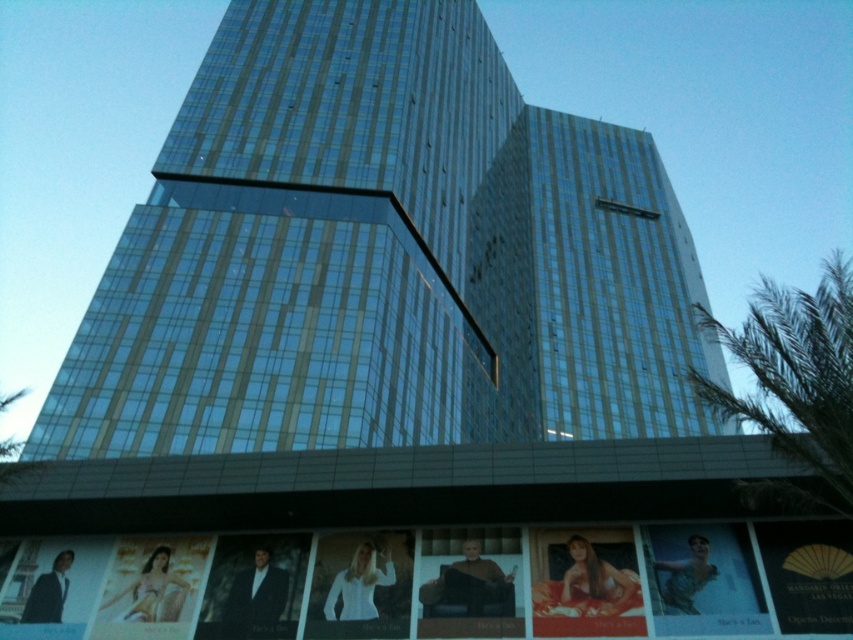
You are a fashion designer observing the scene. You notice the matte blue dress at lower right and the matte black poster at lower left. Which object is positioned higher in the image?

The matte blue dress at lower right is above the matte black poster at lower left, so it is positioned higher in the image.

You are standing in front of the modern building and notice a point marked at coordinates [703,579]. Based on the scene description, can you determine what this point is located on?

The point at coordinates [703,579] is located on the matte blue dress at lower right.

You are a fashion designer observing the scene. You notice the matte blue dress at lower right and the matte gold poster at lower left. Which object is positioned higher in the image?

The matte blue dress at lower right is located above the matte gold poster at lower left, so it is positioned higher in the image.